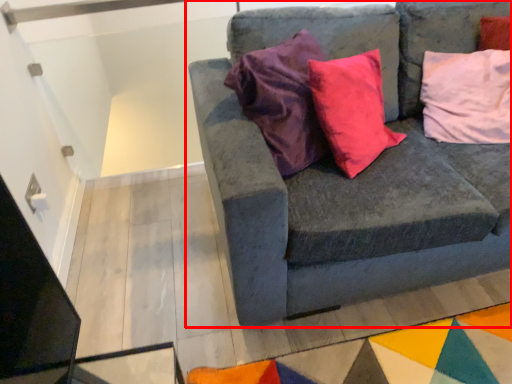
Question: Considering the relative positions of studio couch (annotated by the red box) and pillow in the image provided, where is studio couch (annotated by the red box) located with respect to the staircase?

Choices:
 (A) right
 (B) left

Answer: (B)